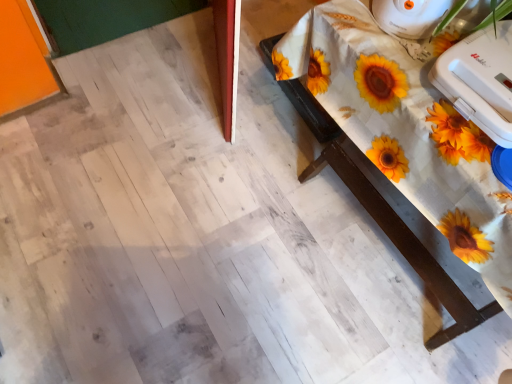
Where is `free spot in front of white plastic iron at upper right, the 1th appliance positioned from the top`? free spot in front of white plastic iron at upper right, the 1th appliance positioned from the top is located at coordinates (399, 62).